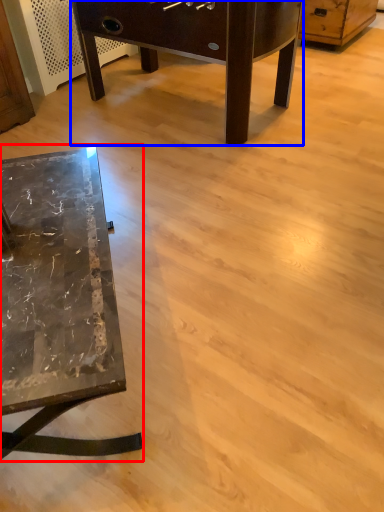
Question: Which point is further to the camera, table (highlighted by a red box) or table (highlighted by a blue box)?

Choices:
 (A) table
 (B) table

Answer: (B)